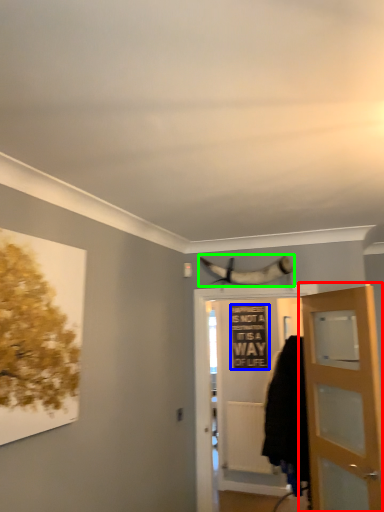
Question: Based on their relative distances, which object is nearer to door (highlighted by a red box)? Choose from picture frame (highlighted by a blue box) and animal (highlighted by a green box).

Choices:
 (A) picture frame
 (B) animal

Answer: (B)